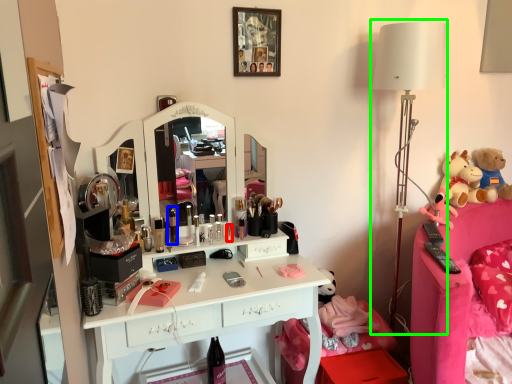
Question: Considering the real-world distances, which object is closest to toiletry (highlighted by a red box)? toiletry (highlighted by a blue box) or table lamp (highlighted by a green box).

Choices:
 (A) toiletry
 (B) table lamp

Answer: (A)